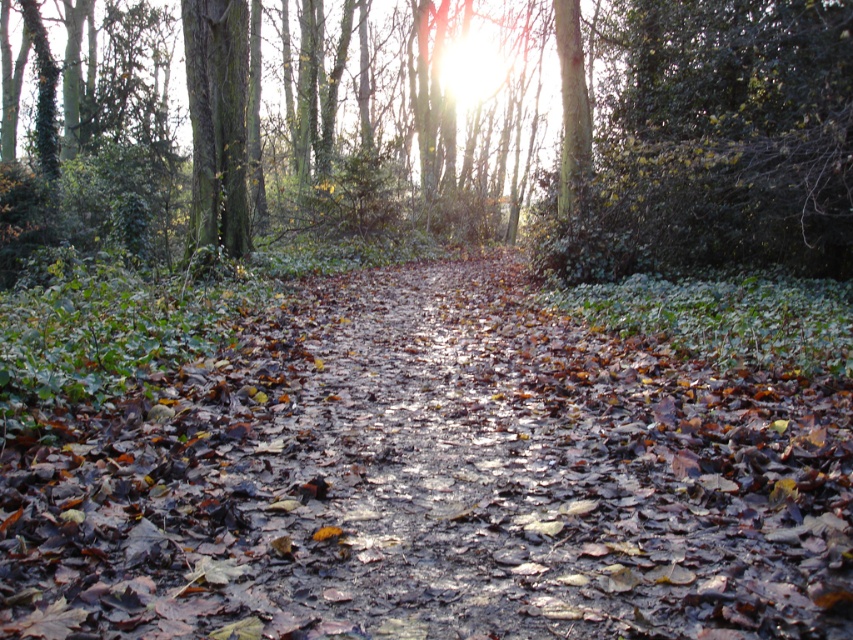
Is green rough bark tree at center below green mossy tree trunk at left?

No, green rough bark tree at center is not below green mossy tree trunk at left.

Is green rough bark tree at center taller than green mossy tree trunk at left?

Correct, green rough bark tree at center is much taller as green mossy tree trunk at left.

Is point (380, 154) closer to viewer compared to point (228, 209)?

No, (380, 154) is further to viewer.

You are a GUI agent. You are given a task and a screenshot of the screen. Output one action in this format:
    pyautogui.click(x=<x>, y=<y>)
    Task: Click on the green rough bark tree at center
    This screenshot has height=640, width=853.
    Given the screenshot: What is the action you would take?
    (x=489, y=132)